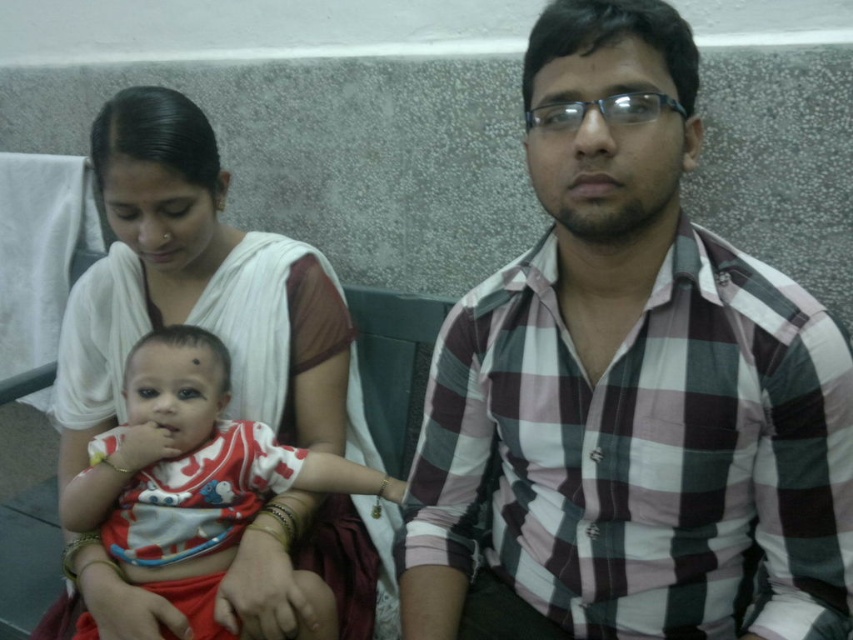
Question: Which of the following is the farthest from the observer?

Choices:
 (A) white cotton shirt at center
 (B) plaid cotton shirt at center

Answer: (A)

Question: Is plaid cotton shirt at center bigger than white cotton shirt at center?

Choices:
 (A) no
 (B) yes

Answer: (B)

Question: Does plaid cotton shirt at center appear on the right side of white cotton shirt at center?

Choices:
 (A) yes
 (B) no

Answer: (A)

Question: Can you confirm if plaid cotton shirt at center is positioned below white cotton shirt at center?

Choices:
 (A) yes
 (B) no

Answer: (B)